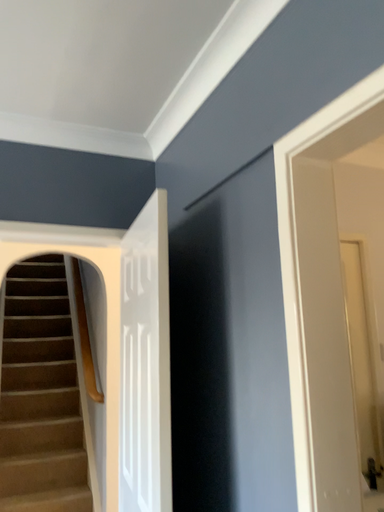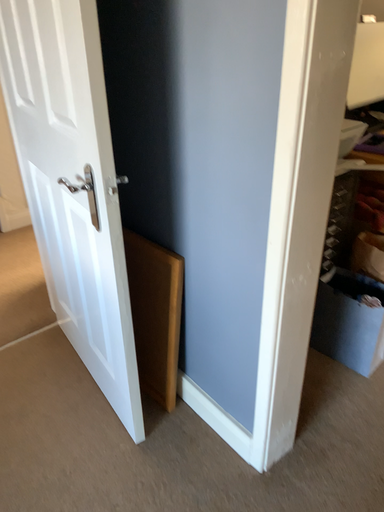
Question: Which way did the camera rotate in the video?

Choices:
 (A) rotated left
 (B) rotated right

Answer: (B)